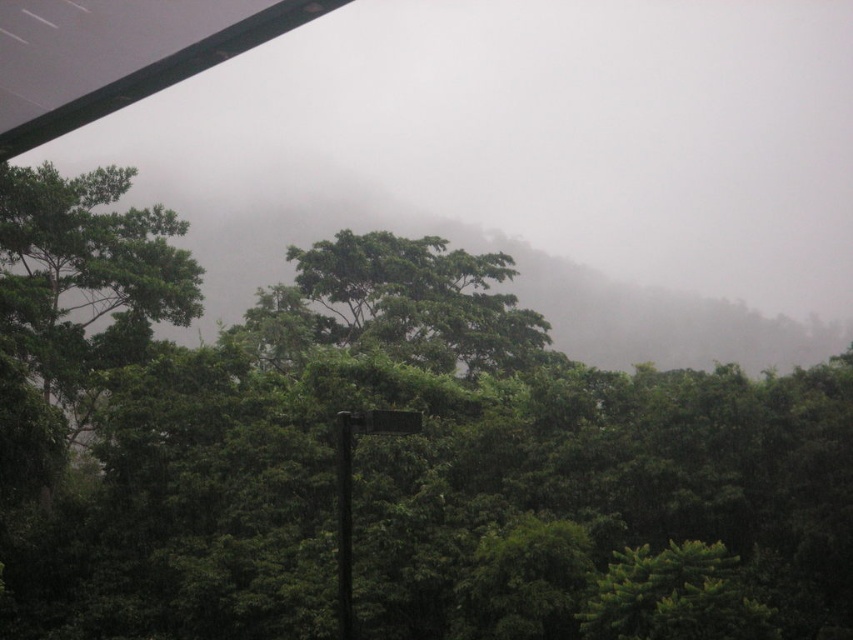
Question: Which point is farther to the camera?

Choices:
 (A) green leafy tree at center
 (B) green matte pole at center

Answer: (A)

Question: Can you confirm if wooden sign at center is bigger than green matte pole at center?

Choices:
 (A) no
 (B) yes

Answer: (B)

Question: Which point appears closest to the camera in this image?

Choices:
 (A) (436, 320)
 (B) (343, 557)
 (C) (344, 472)

Answer: (B)

Question: Which object is positioned closest to the green leafy tree at center?

Choices:
 (A) green matte pole at center
 (B) wooden sign at center

Answer: (B)

Question: Is wooden sign at center to the right of green matte pole at center from the viewer's perspective?

Choices:
 (A) no
 (B) yes

Answer: (B)

Question: Does green leafy tree at center have a smaller size compared to wooden sign at center?

Choices:
 (A) no
 (B) yes

Answer: (A)